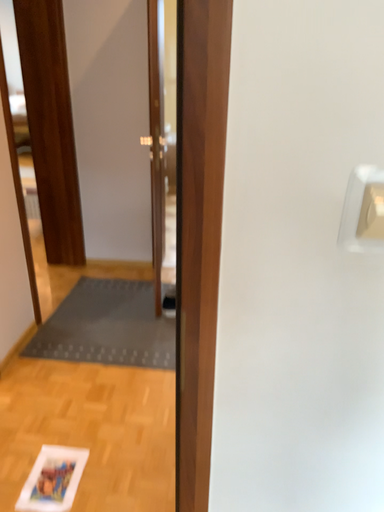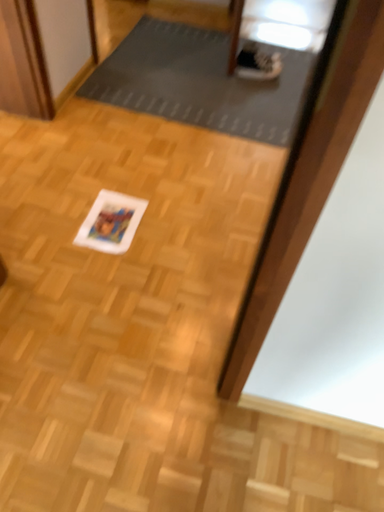
Question: How did the camera likely rotate when shooting the video?

Choices:
 (A) rotated left
 (B) rotated right

Answer: (A)